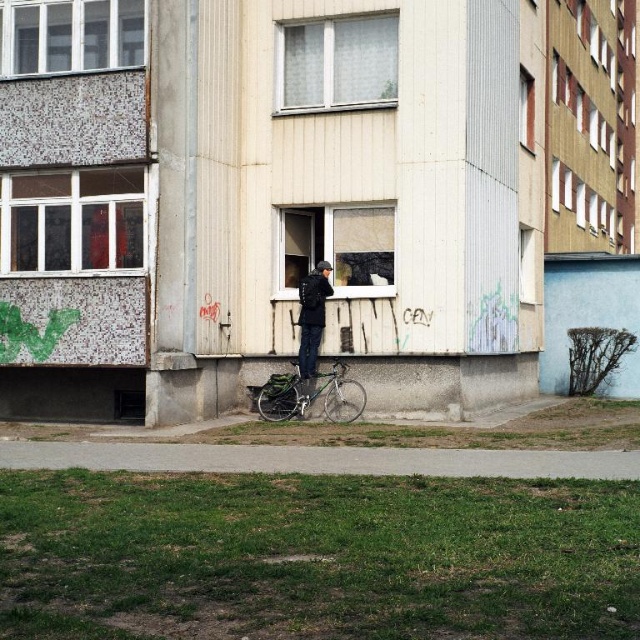
Does shiny metallic bicycle at center appear over dark blue fabric jacket at center?

Actually, shiny metallic bicycle at center is below dark blue fabric jacket at center.

Which is behind, point (330, 387) or point (316, 269)?

The point (316, 269) is behind.

Identify the location of shiny metallic bicycle at center. (310, 396).